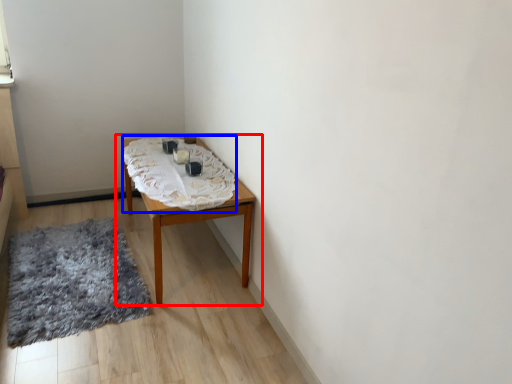
Question: Among these objects, which one is farthest to the camera, table (highlighted by a red box) or blanket (highlighted by a blue box)?

Choices:
 (A) table
 (B) blanket

Answer: (A)